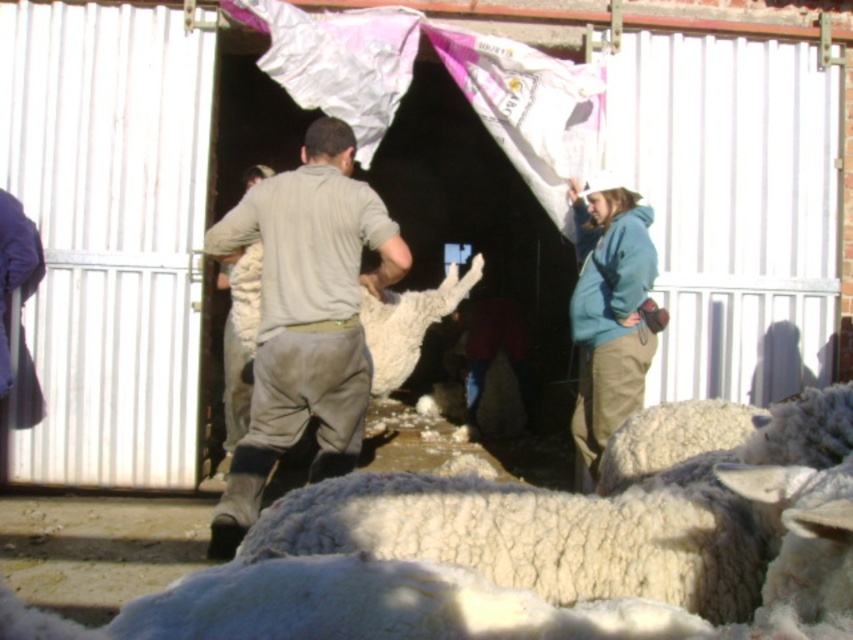
Question: Is white woolen sheep at center closer to camera compared to gray cotton shirt at center?

Choices:
 (A) yes
 (B) no

Answer: (A)

Question: Among these objects, which one is farthest from the camera?

Choices:
 (A) gray cotton shirt at center
 (B) white woolen sheep at center

Answer: (A)

Question: Considering the real-world distances, which object is closest to the gray cotton shirt at center?

Choices:
 (A) white woolen sheep at center
 (B) white fluffy wool at center

Answer: (B)

Question: In this image, where is white woolen sheep at center located relative to gray cotton shirt at center?

Choices:
 (A) below
 (B) above

Answer: (A)

Question: Is white woolen sheep at center closer to the viewer compared to white fluffy wool at center?

Choices:
 (A) yes
 (B) no

Answer: (A)

Question: Among these points, which one is nearest to the camera?

Choices:
 (A) (532, 584)
 (B) (380, 301)

Answer: (A)